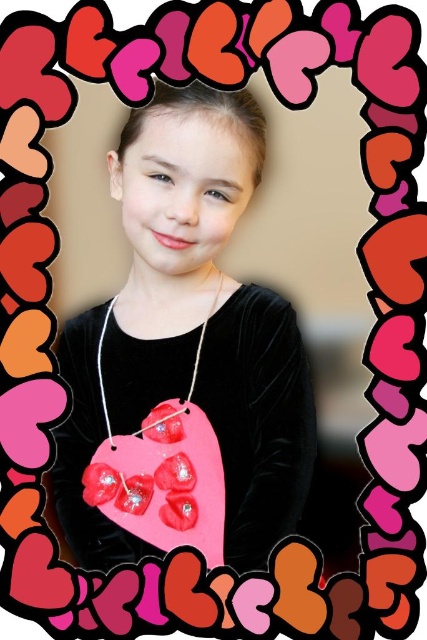
Question: Which point is closer to the camera?

Choices:
 (A) matte pink heart at center
 (B) matte velvet heart at center

Answer: (A)

Question: Is matte pink heart at center in front of matte velvet heart at center?

Choices:
 (A) no
 (B) yes

Answer: (B)

Question: Does matte pink heart at center have a greater width compared to matte velvet heart at center?

Choices:
 (A) yes
 (B) no

Answer: (A)

Question: Where is matte pink heart at center located in relation to matte velvet heart at center in the image?

Choices:
 (A) above
 (B) below

Answer: (A)